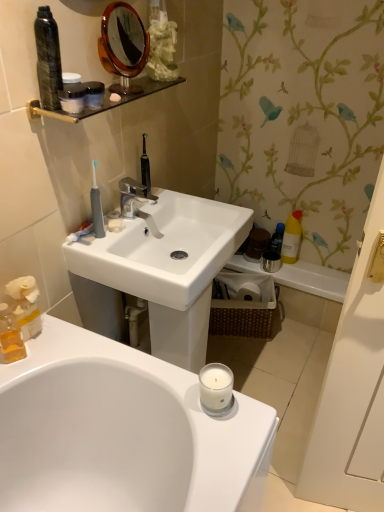
Question: Can you confirm if white matte soap at center is thinner than matte black container at upper left, marked as the 3th mouthwash in a front-to-back arrangement?

Choices:
 (A) no
 (B) yes

Answer: (B)

Question: Can you confirm if white matte soap at center is smaller than matte black container at upper left, which ranks as the second mouthwash in left-to-right order?

Choices:
 (A) no
 (B) yes

Answer: (B)

Question: From the image's perspective, is white matte soap at center above matte black container at upper left, which ranks as the second mouthwash in left-to-right order?

Choices:
 (A) no
 (B) yes

Answer: (A)

Question: Does white matte soap at center have a greater height compared to matte black container at upper left, which appears as the fifth mouthwash when ordered from the bottom?

Choices:
 (A) no
 (B) yes

Answer: (A)

Question: Is white matte soap at center further to camera compared to matte black container at upper left, which appears as the fifth mouthwash when ordered from the bottom?

Choices:
 (A) yes
 (B) no

Answer: (A)

Question: Considering their positions, is white ceramic faucet at center located in front of or behind gray rubber toothbrush at upper left?

Choices:
 (A) behind
 (B) front

Answer: (A)

Question: From the image's perspective, is white ceramic faucet at center positioned above or below gray rubber toothbrush at upper left?

Choices:
 (A) above
 (B) below

Answer: (A)

Question: Considering the positions of white ceramic faucet at center and gray rubber toothbrush at upper left in the image, is white ceramic faucet at center taller or shorter than gray rubber toothbrush at upper left?

Choices:
 (A) tall
 (B) short

Answer: (B)

Question: Choose the correct answer: Is white ceramic faucet at center inside gray rubber toothbrush at upper left or outside it?

Choices:
 (A) outside
 (B) inside

Answer: (A)

Question: From the image's perspective, is blue plastic bottle at right, placed as the first mouthwash when sorted from back to front, above or below white ceramic faucet at center?

Choices:
 (A) below
 (B) above

Answer: (A)

Question: In terms of width, does blue plastic bottle at right, placed as the first mouthwash when sorted from back to front, look wider or thinner when compared to white ceramic faucet at center?

Choices:
 (A) thin
 (B) wide

Answer: (A)

Question: Looking at the image, does blue plastic bottle at right, the second mouthwash positioned from the bottom, seem bigger or smaller compared to white ceramic faucet at center?

Choices:
 (A) small
 (B) big

Answer: (A)

Question: In the image, is blue plastic bottle at right, the second mouthwash positioned from the right, on the left side or the right side of white ceramic faucet at center?

Choices:
 (A) right
 (B) left

Answer: (A)

Question: Based on their sizes in the image, would you say black glass shelf at upper center is bigger or smaller than blue plastic bottle at right, placed as the fourth mouthwash when sorted from left to right?

Choices:
 (A) big
 (B) small

Answer: (A)

Question: Based on their positions, is black glass shelf at upper center located to the left or right of blue plastic bottle at right, placed as the fourth mouthwash when sorted from left to right?

Choices:
 (A) left
 (B) right

Answer: (A)